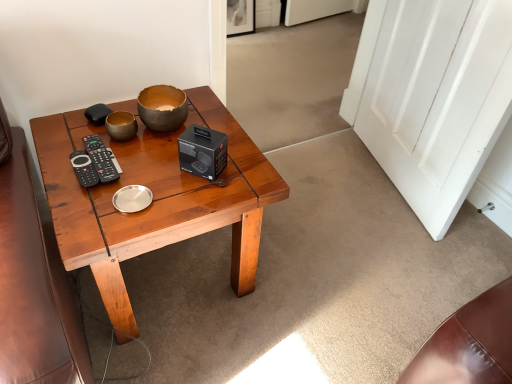
Question: Considering the relative positions of white glossy door at right and black plastic remote at left in the image provided, is white glossy door at right to the right of black plastic remote at left from the viewer's perspective?

Choices:
 (A) no
 (B) yes

Answer: (B)

Question: From the image's perspective, is white glossy door at right beneath black plastic remote at left?

Choices:
 (A) yes
 (B) no

Answer: (B)

Question: Is white glossy door at right far away from black plastic remote at left?

Choices:
 (A) no
 (B) yes

Answer: (B)

Question: Are white glossy door at right and black plastic remote at left making contact?

Choices:
 (A) yes
 (B) no

Answer: (B)

Question: Is white glossy door at right positioned with its back to black plastic remote at left?

Choices:
 (A) yes
 (B) no

Answer: (B)

Question: Does white glossy door at right contain black plastic remote at left?

Choices:
 (A) no
 (B) yes

Answer: (A)

Question: Does black plastic remote at left lie in front of white glossy door at right?

Choices:
 (A) no
 (B) yes

Answer: (A)

Question: From a real-world perspective, is black plastic remote at left located higher than white glossy door at right?

Choices:
 (A) yes
 (B) no

Answer: (A)

Question: Does black plastic remote at left have a larger size compared to white glossy door at right?

Choices:
 (A) yes
 (B) no

Answer: (B)

Question: From the image's perspective, does black plastic remote at left appear higher than white glossy door at right?

Choices:
 (A) yes
 (B) no

Answer: (B)

Question: Is black plastic remote at left not near white glossy door at right?

Choices:
 (A) no
 (B) yes

Answer: (B)

Question: Is black plastic remote at left surrounding white glossy door at right?

Choices:
 (A) yes
 (B) no

Answer: (B)

Question: Is matte brown bowl at center to the right of wooden coffee table at center from the viewer's perspective?

Choices:
 (A) yes
 (B) no

Answer: (A)